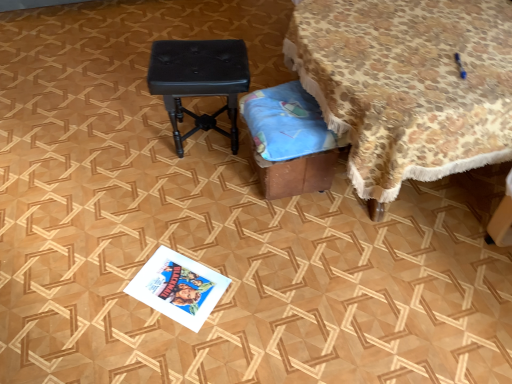
Find the location of a particular element. free space in front of white glossy magazine at lower center is located at coordinates (167, 349).